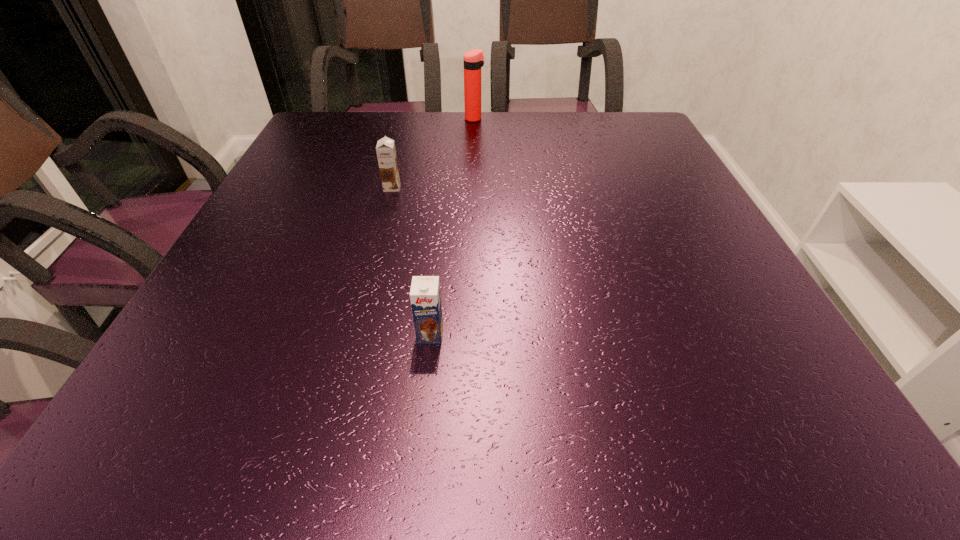
The image size is (960, 540). I want to click on vacant area at the far edge, so 525,131.

In the image, there is a desktop. At what (x,y) coordinates should I click in order to perform the action: click on free space at the near edge. Please return your answer as a coordinate pair (x, y). Looking at the image, I should click on (588, 392).

Where is `free space at the left edge of the desktop`? The image size is (960, 540). free space at the left edge of the desktop is located at coordinates (252, 254).

Locate an element on the screen. The image size is (960, 540). blank area at the right edge is located at coordinates (704, 322).

Image resolution: width=960 pixels, height=540 pixels. What are the coordinates of `vacant region at the far left corner of the desktop` in the screenshot? It's located at (319, 140).

In the image, there is a desktop. Where is `vacant space at the near right corner`? The height and width of the screenshot is (540, 960). vacant space at the near right corner is located at coordinates (814, 420).

Where is `empty space that is in between the farthest object and the right chocolate milk`? The image size is (960, 540). empty space that is in between the farthest object and the right chocolate milk is located at coordinates (452, 226).

I want to click on free point between the leftmost object and the nearest object, so click(411, 261).

Find the location of a particular element. This screenshot has width=960, height=540. free area in between the thermos bottle and the right chocolate milk is located at coordinates (452, 226).

Where is `free space between the right chocolate milk and the leftmost object`? free space between the right chocolate milk and the leftmost object is located at coordinates (411, 261).